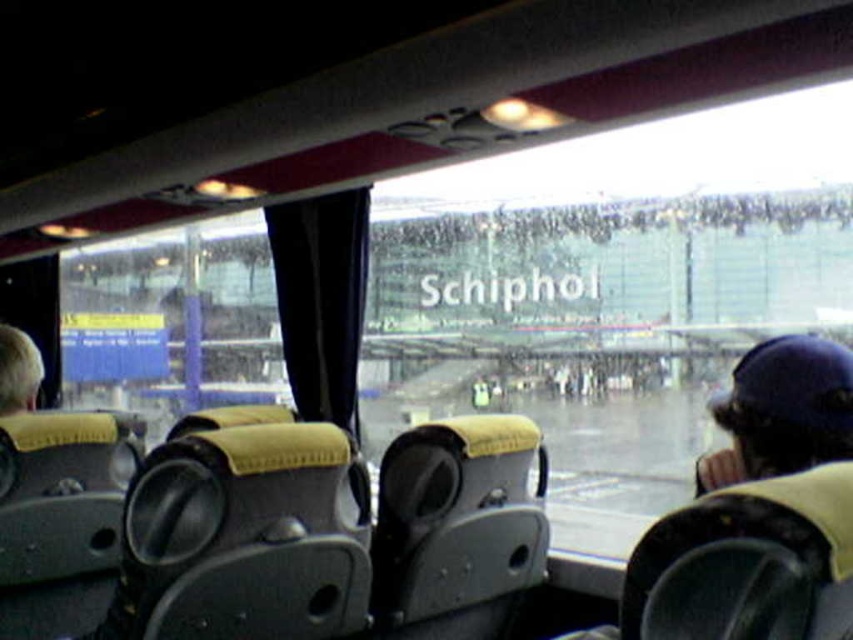
Question: Is blue fabric cap at right positioned at the back of blonde hair at lower left?

Choices:
 (A) no
 (B) yes

Answer: (A)

Question: Can you confirm if blue fabric cap at right is smaller than blonde hair at lower left?

Choices:
 (A) yes
 (B) no

Answer: (B)

Question: Which object is closer to the camera taking this photo?

Choices:
 (A) blue fabric cap at right
 (B) blonde hair at lower left

Answer: (A)

Question: Can you confirm if blue fabric cap at right is wider than blonde hair at lower left?

Choices:
 (A) no
 (B) yes

Answer: (B)